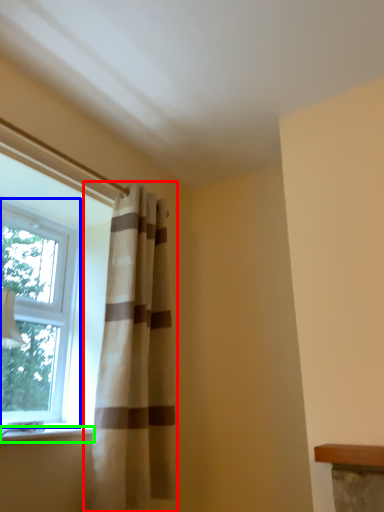
Question: Considering the real-world distances, which object is farthest from curtain (highlighted by a red box)? window (highlighted by a blue box) or window sill (highlighted by a green box)?

Choices:
 (A) window
 (B) window sill

Answer: (A)